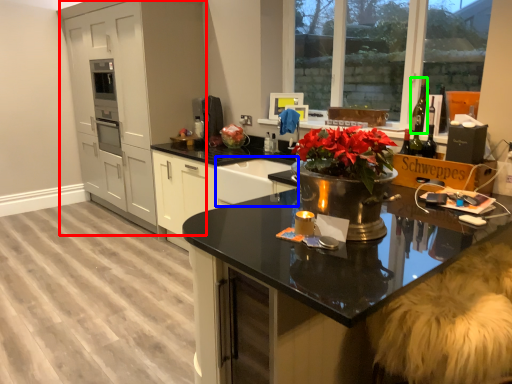
Question: Estimate the real-world distances between objects in this image. Which object is closer to cabinetry (highlighted by a red box), sink (highlighted by a blue box) or wine bottle (highlighted by a green box)?

Choices:
 (A) sink
 (B) wine bottle

Answer: (A)